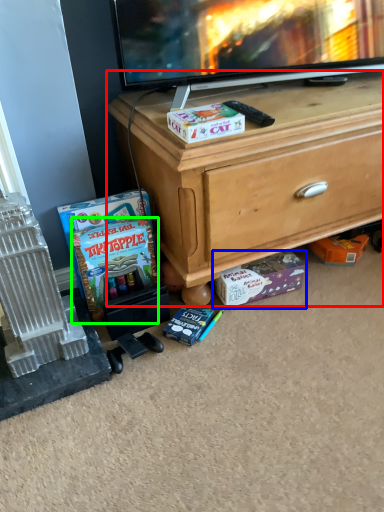
Question: Which object is positioned farthest from desk (highlighted by a red box)? Select from cardboard box (highlighted by a blue box) and comic book (highlighted by a green box).

Choices:
 (A) cardboard box
 (B) comic book

Answer: (B)